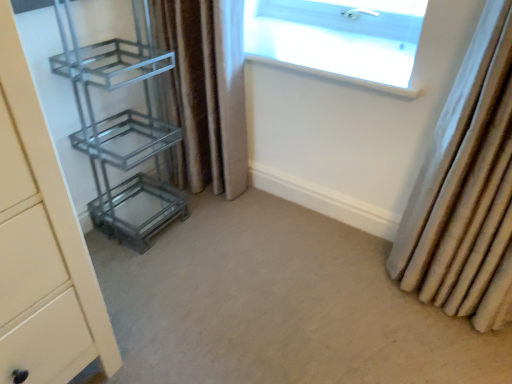
Find the location of a particular element. brown textured curtain at center, the 1th curtain in the left-to-right sequence is located at coordinates (207, 88).

What is the approximate height of beige carpet at center?

1.36 inches.

Describe the element at coordinates (121, 125) in the screenshot. This screenshot has width=512, height=384. I see `metallic glass shelf at left` at that location.

This screenshot has height=384, width=512. Identify the location of transparent glass window at upper center. (338, 38).

Locate an element on the screen. The image size is (512, 384). brown textured curtain at center, the 1th curtain in the left-to-right sequence is located at coordinates [207, 88].

Can you tell me how much metallic glass shelf at left and beige fabric curtain at right, marked as the second curtain in a left-to-right arrangement, differ in facing direction?

85.6 degrees.

Considering the sizes of objects metallic glass shelf at left and beige fabric curtain at right, marked as the second curtain in a left-to-right arrangement, in the image provided, who is wider, metallic glass shelf at left or beige fabric curtain at right, marked as the second curtain in a left-to-right arrangement,?

Wider between the two is metallic glass shelf at left.

Does metallic glass shelf at left contain beige fabric curtain at right, marked as the second curtain in a left-to-right arrangement?

No, metallic glass shelf at left does not contain beige fabric curtain at right, marked as the second curtain in a left-to-right arrangement.

Based on the photo, is metallic glass shelf at left facing towards beige fabric curtain at right, which is counted as the 1th curtain, starting from the right?

Yes, metallic glass shelf at left is facing beige fabric curtain at right, which is counted as the 1th curtain, starting from the right.

Which is closer, (483,261) or (112,188)?

Point (483,261)

Is beige fabric curtain at right, which is counted as the 1th curtain, starting from the right, in contact with metallic glass shelf at left?

There is a gap between beige fabric curtain at right, which is counted as the 1th curtain, starting from the right, and metallic glass shelf at left.

How much distance is there between beige fabric curtain at right, which is counted as the 1th curtain, starting from the right, and metallic glass shelf at left?

A distance of 38.12 inches exists between beige fabric curtain at right, which is counted as the 1th curtain, starting from the right, and metallic glass shelf at left.

Find the location of a particular element. shelf above the beige fabric curtain at right, marked as the second curtain in a left-to-right arrangement (from the image's perspective) is located at coordinates (121, 125).

What's the angular difference between beige fabric curtain at right, which is counted as the 1th curtain, starting from the right, and brown textured curtain at center, the second curtain in the right-to-left sequence,'s facing directions?

0.0047 degrees.

Could you measure the distance between beige fabric curtain at right, marked as the second curtain in a left-to-right arrangement, and brown textured curtain at center, the second curtain in the right-to-left sequence?

beige fabric curtain at right, marked as the second curtain in a left-to-right arrangement, and brown textured curtain at center, the second curtain in the right-to-left sequence, are 31.59 inches apart from each other.

Can we say beige fabric curtain at right, which is counted as the 1th curtain, starting from the right, lies outside brown textured curtain at center, the second curtain in the right-to-left sequence?

beige fabric curtain at right, which is counted as the 1th curtain, starting from the right, lies outside brown textured curtain at center, the second curtain in the right-to-left sequence,'s area.

From the image's perspective, would you say beige fabric curtain at right, which is counted as the 1th curtain, starting from the right, is shown under brown textured curtain at center, the second curtain in the right-to-left sequence?

Yes, from the image's perspective, beige fabric curtain at right, which is counted as the 1th curtain, starting from the right, is beneath brown textured curtain at center, the second curtain in the right-to-left sequence.

Can you see brown textured curtain at center, the 1th curtain in the left-to-right sequence, touching transparent glass window at upper center?

No, brown textured curtain at center, the 1th curtain in the left-to-right sequence, is not beside transparent glass window at upper center.

From a real-world perspective, is brown textured curtain at center, the second curtain in the right-to-left sequence, above or below transparent glass window at upper center?

brown textured curtain at center, the second curtain in the right-to-left sequence, is below transparent glass window at upper center.

How many degrees apart are the facing directions of brown textured curtain at center, the second curtain in the right-to-left sequence, and transparent glass window at upper center?

They differ by 2.27 degrees in their facing directions.

Choose the correct answer: Is beige fabric curtain at right, marked as the second curtain in a left-to-right arrangement, inside beige carpet at center or outside it?

beige fabric curtain at right, marked as the second curtain in a left-to-right arrangement, is spatially situated outside beige carpet at center.

Is beige fabric curtain at right, marked as the second curtain in a left-to-right arrangement, to the left of beige carpet at center from the viewer's perspective?

No.

What's the angular difference between beige fabric curtain at right, which is counted as the 1th curtain, starting from the right, and beige carpet at center's facing directions?

They differ by 92.4 degrees in their facing directions.

Considering their positions, is beige carpet at center located in front of or behind transparent glass window at upper center?

In the image, beige carpet at center appears in front of transparent glass window at upper center.

In the scene shown: From a real-world perspective, is beige carpet at center positioned over transparent glass window at upper center based on gravity?

Actually, beige carpet at center is physically below transparent glass window at upper center in the real world.

Considering the relative sizes of beige carpet at center and transparent glass window at upper center in the image provided, is beige carpet at center shorter than transparent glass window at upper center?

Yes, beige carpet at center is shorter than transparent glass window at upper center.

Is beige carpet at center smaller than transparent glass window at upper center?

Actually, beige carpet at center might be larger than transparent glass window at upper center.

Is beige fabric curtain at right, which is counted as the 1th curtain, starting from the right, outside of transparent glass window at upper center?

That's correct, beige fabric curtain at right, which is counted as the 1th curtain, starting from the right, is outside of transparent glass window at upper center.

Can you see beige fabric curtain at right, marked as the second curtain in a left-to-right arrangement, touching transparent glass window at upper center?

beige fabric curtain at right, marked as the second curtain in a left-to-right arrangement, and transparent glass window at upper center are not in contact.

Is beige fabric curtain at right, marked as the second curtain in a left-to-right arrangement, facing away from transparent glass window at upper center?

No, beige fabric curtain at right, marked as the second curtain in a left-to-right arrangement, is not facing away from transparent glass window at upper center.

How different are the orientations of beige fabric curtain at right, which is counted as the 1th curtain, starting from the right, and transparent glass window at upper center in degrees?

The angular difference between beige fabric curtain at right, which is counted as the 1th curtain, starting from the right, and transparent glass window at upper center is 2.27 degrees.

Locate an element on the screen. shelf behind the beige fabric curtain at right, which is counted as the 1th curtain, starting from the right is located at coordinates (121, 125).

This screenshot has width=512, height=384. Identify the location of shelf that is above the beige fabric curtain at right, which is counted as the 1th curtain, starting from the right (from the image's perspective). 121,125.

Estimate the real-world distances between objects in this image. Which object is further from transparent glass window at upper center, metallic glass shelf at left or beige carpet at center?

beige carpet at center.

Which object lies nearer to the anchor point transparent glass window at upper center, beige fabric curtain at right, marked as the second curtain in a left-to-right arrangement, or metallic glass shelf at left?

beige fabric curtain at right, marked as the second curtain in a left-to-right arrangement, lies closer to transparent glass window at upper center than the other object.

Considering their positions, is beige fabric curtain at right, which is counted as the 1th curtain, starting from the right, positioned closer to beige carpet at center than metallic glass shelf at left?

Based on the image, beige fabric curtain at right, which is counted as the 1th curtain, starting from the right, appears to be nearer to beige carpet at center.

When comparing their distances from transparent glass window at upper center, does brown textured curtain at center, the 1th curtain in the left-to-right sequence, or beige fabric curtain at right, which is counted as the 1th curtain, starting from the right, seem closer?

brown textured curtain at center, the 1th curtain in the left-to-right sequence, is positioned closer to the anchor transparent glass window at upper center.

From the image, which object appears to be farther from metallic glass shelf at left, brown textured curtain at center, the 1th curtain in the left-to-right sequence, or beige fabric curtain at right, which is counted as the 1th curtain, starting from the right?

The object further to metallic glass shelf at left is beige fabric curtain at right, which is counted as the 1th curtain, starting from the right.

From the image, which object appears to be nearer to metallic glass shelf at left, transparent glass window at upper center or beige carpet at center?

The object closer to metallic glass shelf at left is beige carpet at center.

Considering their positions, is beige fabric curtain at right, which is counted as the 1th curtain, starting from the right, positioned closer to transparent glass window at upper center than brown textured curtain at center, the second curtain in the right-to-left sequence?

brown textured curtain at center, the second curtain in the right-to-left sequence.

Considering their positions, is metallic glass shelf at left positioned further to beige carpet at center than brown textured curtain at center, the second curtain in the right-to-left sequence?

brown textured curtain at center, the second curtain in the right-to-left sequence, is positioned further to the anchor beige carpet at center.

Locate an element on the screen. This screenshot has width=512, height=384. shelf that lies between brown textured curtain at center, the 1th curtain in the left-to-right sequence, and beige carpet at center from top to bottom is located at coordinates (121, 125).

Find the location of `curtain situated between metallic glass shelf at left and transparent glass window at upper center from left to right`. curtain situated between metallic glass shelf at left and transparent glass window at upper center from left to right is located at coordinates (207, 88).

At what (x,y) coordinates should I click in order to perform the action: click on shelf between transparent glass window at upper center and beige carpet at center in the up-down direction. Please return your answer as a coordinate pair (x, y). Looking at the image, I should click on (121, 125).

You are a GUI agent. You are given a task and a screenshot of the screen. Output one action in this format:
    pyautogui.click(x=<x>, y=<y>)
    Task: Click on the window between brown textured curtain at center, the 1th curtain in the left-to-right sequence, and beige fabric curtain at right, marked as the second curtain in a left-to-right arrangement
    This screenshot has height=384, width=512.
    Given the screenshot: What is the action you would take?
    pyautogui.click(x=338, y=38)